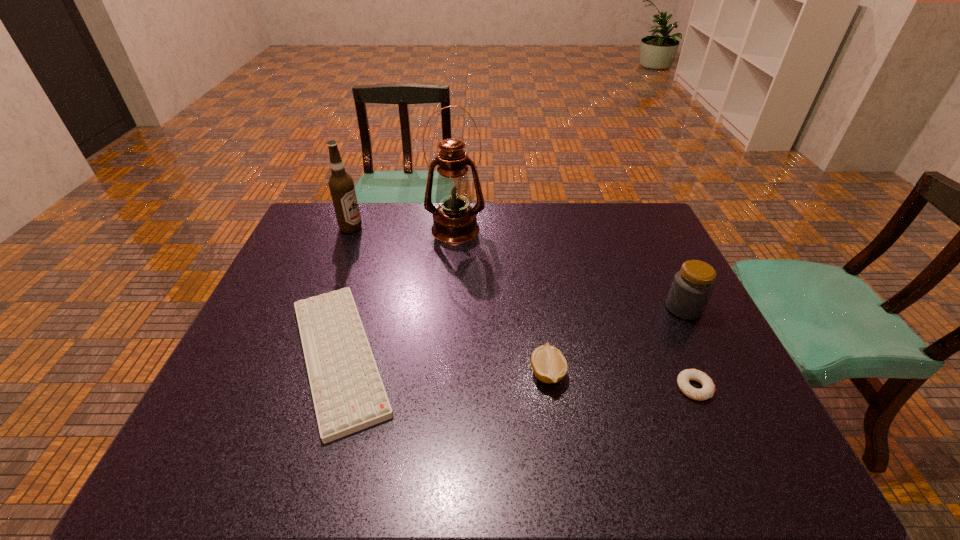
Locate an element on the screen. Image resolution: width=960 pixels, height=540 pixels. vacant space that's between the doughnut and the jar is located at coordinates (688, 348).

Identify the location of empty space between the fourth object from right to left and the doughnut. (575, 308).

Locate an element on the screen. This screenshot has width=960, height=540. free spot between the fourth shortest object and the computer keyboard is located at coordinates (512, 332).

The height and width of the screenshot is (540, 960). In order to click on vacant area that lies between the jar and the fifth shortest object in this screenshot , I will do `click(517, 268)`.

Image resolution: width=960 pixels, height=540 pixels. I want to click on unoccupied area between the oil lamp and the computer keyboard, so click(397, 293).

In order to click on empty space that is in between the fourth shortest object and the lemon in this screenshot , I will do `click(615, 341)`.

What are the coordinates of `vacant region between the third tallest object and the computer keyboard` in the screenshot? It's located at (512, 332).

At what (x,y) coordinates should I click in order to perform the action: click on unoccupied position between the doughnut and the fourth shortest object. Please return your answer as a coordinate pair (x, y). Looking at the image, I should click on (688, 348).

Identify the location of vacant area that lies between the alcohol and the fourth shortest object. The image size is (960, 540). (517, 268).

Where is `vacant point located between the third shortest object and the oil lamp`? vacant point located between the third shortest object and the oil lamp is located at coordinates (501, 301).